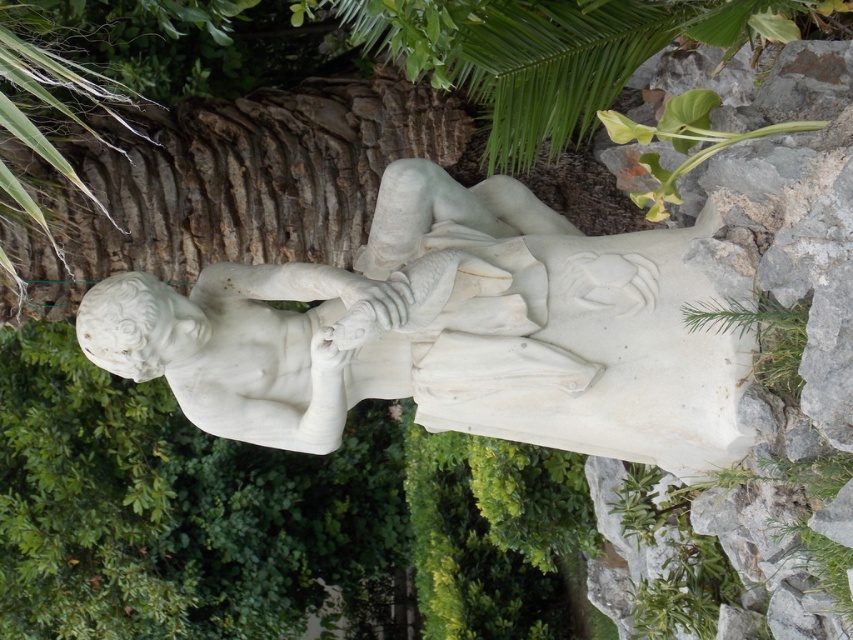
You are standing in front of the classical marble statue of a man and a child. You notice two specific points on the statue marked as point 1 at coordinates (190,339) and point 2 at coordinates (770,307). From your perspective, which point is closer to you?

Point 2 at coordinates (770,307) is closer to you because the description states that point (190,339) is behind point (770,307).

You are standing in front of the statue and want to take a photo of it. Your camera can focus on objects up to 2 meters away. Will the white marble statue at center be in focus?

The white marble statue at center is 2.22 meters from viewer, which is beyond the camera focus limit of 2 meters. Therefore, the statue will not be in focus.